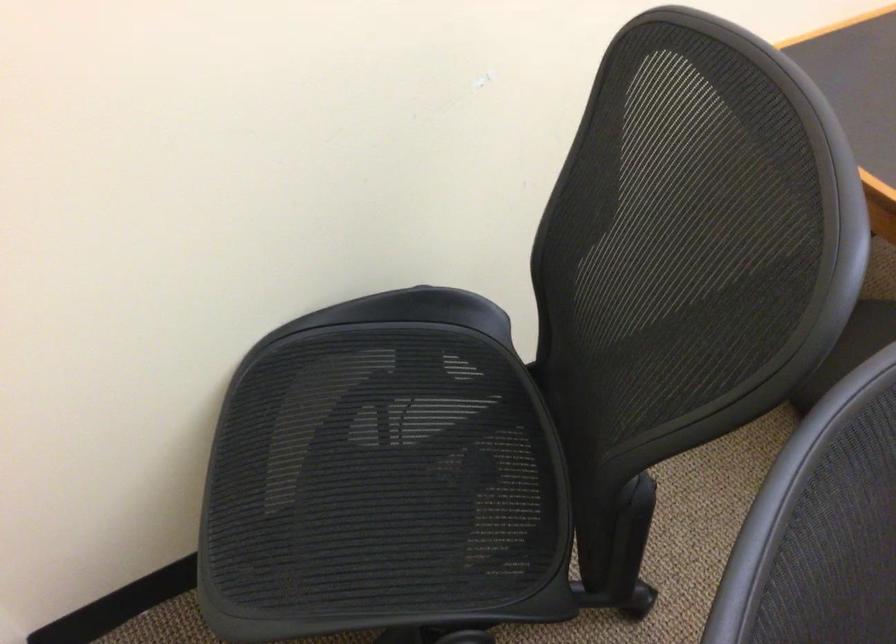
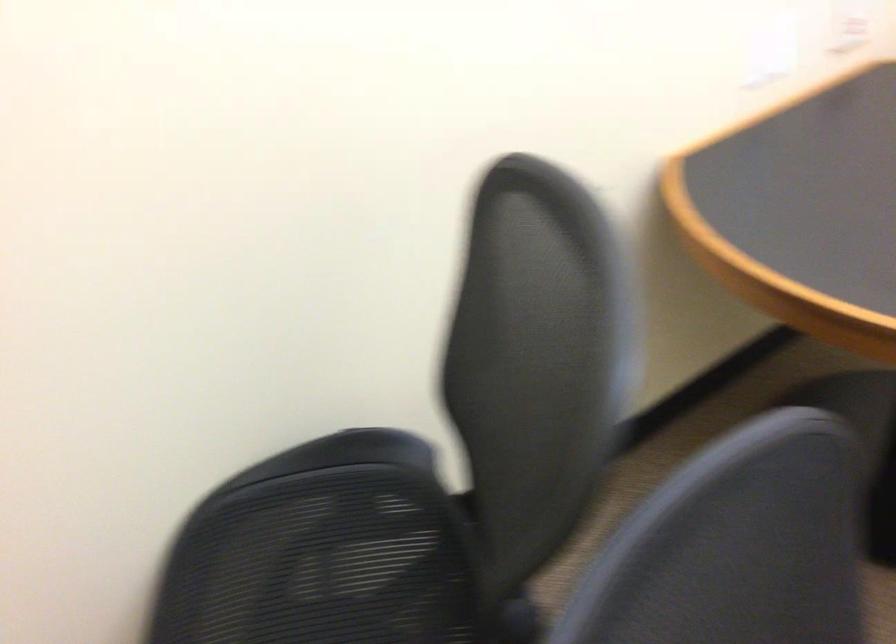
In the second image, find the point that corresponds to pixel 390 413 in the first image.

(320, 565)